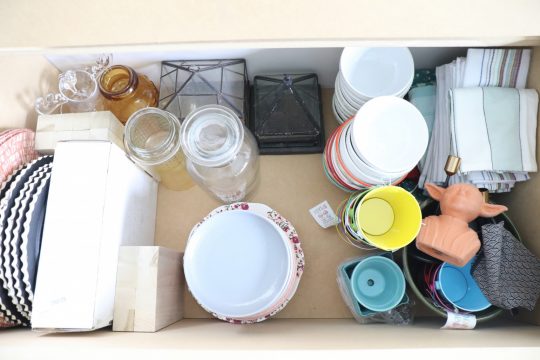
Locate an element on the screen. bowl is located at coordinates (259, 269).